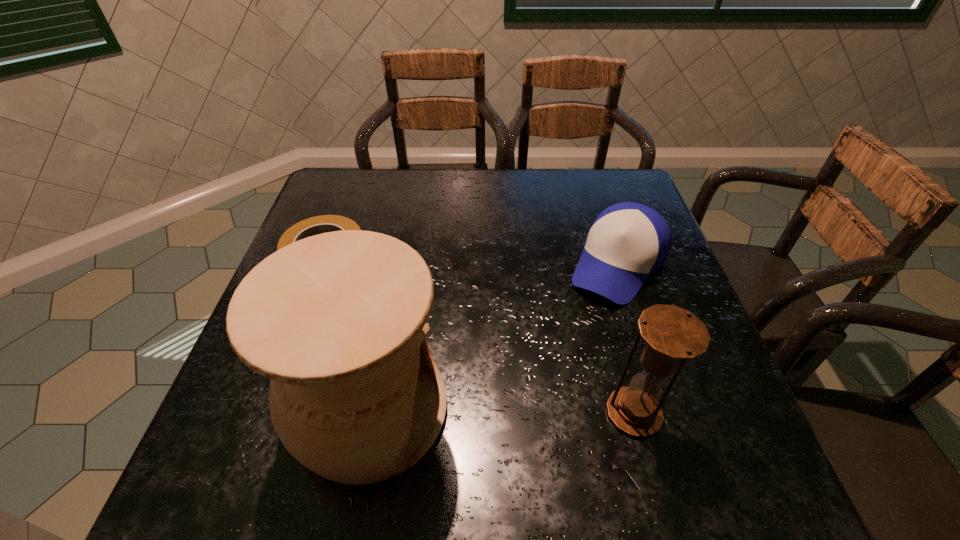
Locate an element on the screen. Image resolution: width=960 pixels, height=540 pixels. pottery is located at coordinates (337, 321).

Locate an element on the screen. the third shortest object is located at coordinates (671, 333).

In order to click on duct tape in this screenshot , I will do `click(316, 225)`.

Where is `baseball cap`? The width and height of the screenshot is (960, 540). baseball cap is located at coordinates (628, 241).

Find the location of a particular element. vacant region located at the open side of the pottery is located at coordinates (501, 410).

The image size is (960, 540). I want to click on vacant space located 0.050m on the left of the hourglass, so click(580, 413).

The height and width of the screenshot is (540, 960). I want to click on vacant space positioned 0.160m at the edge of the shortest object, so click(390, 319).

At what (x,y) coordinates should I click in order to perform the action: click on vacant space located at the edge of the shortest object. Please return your answer as a coordinate pair (x, y). Looking at the image, I should click on (428, 354).

The height and width of the screenshot is (540, 960). I want to click on vacant space located 0.100m at the edge of the shortest object, so click(374, 305).

At what (x,y) coordinates should I click in order to perform the action: click on vacant region located on the front-facing side of the third tallest object. Please return your answer as a coordinate pair (x, y). The image size is (960, 540). Looking at the image, I should click on (558, 356).